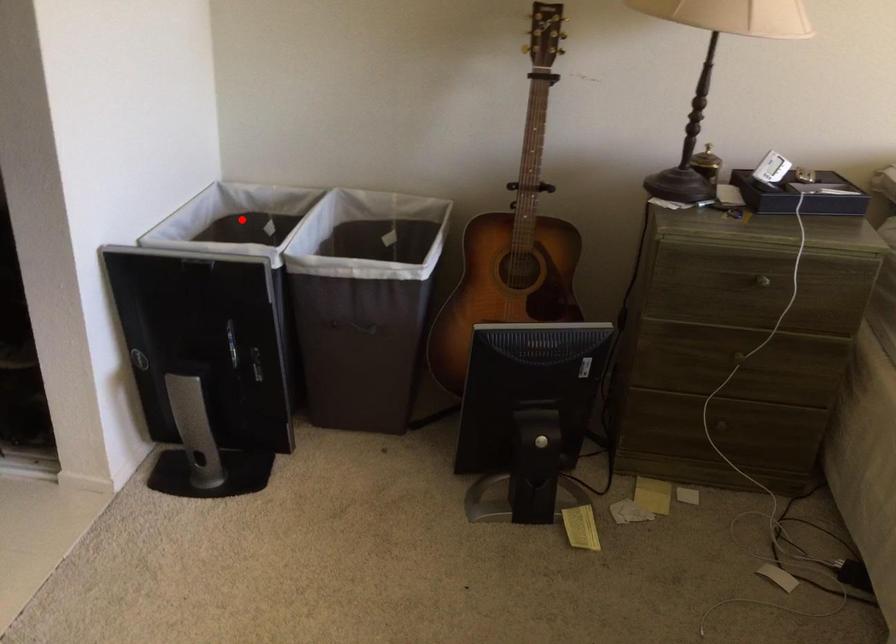
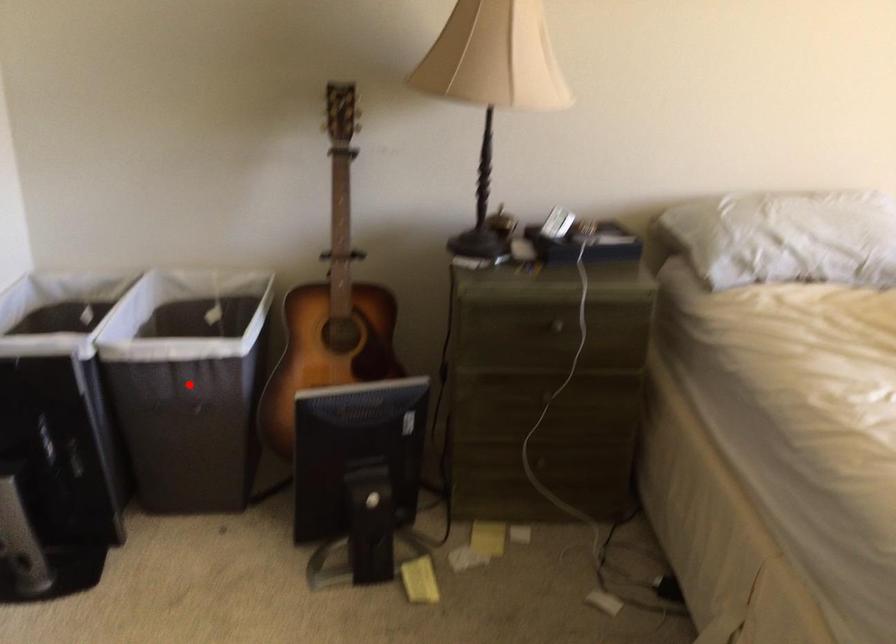
I am providing you with two images of the same scene from different viewpoints. A red point is marked on the first image and another point is marked on the second image. Do the highlighted points in image1 and image2 indicate the same real-world spot?

No